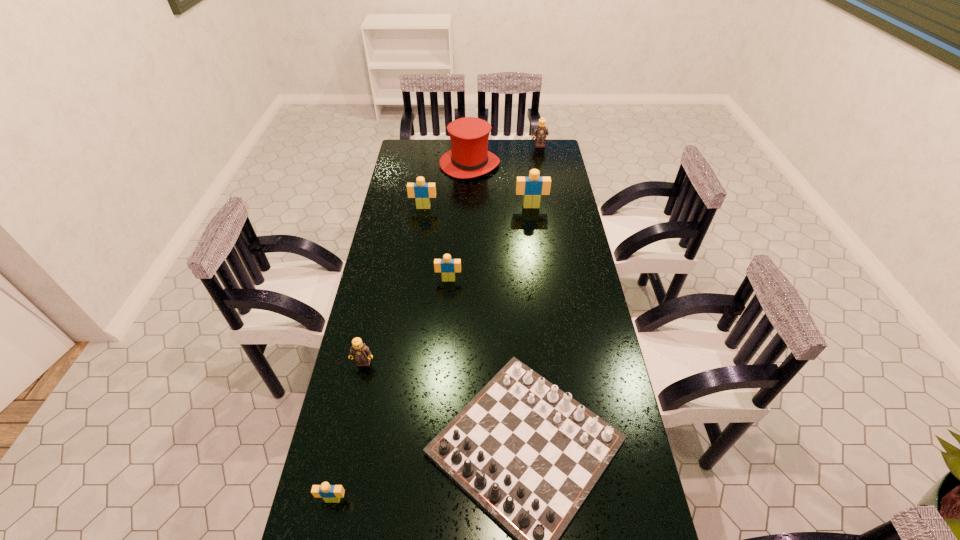
Identify which tan Lego is located as the second nearest to the hat. Please provide its 2D coordinates. Your answer should be formatted as a tuple, i.e. [(x, y)], where the tuple contains the x and y coordinates of a point satisfying the conditions above.

[(359, 351)]